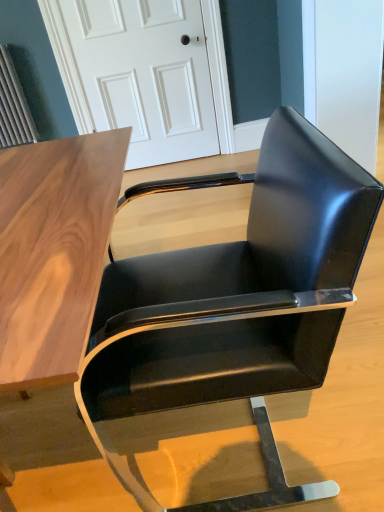
Question: Are glossy black chair at center and white glossy door at upper center located far from each other?

Choices:
 (A) no
 (B) yes

Answer: (B)

Question: Can you confirm if glossy black chair at center is shorter than white glossy door at upper center?

Choices:
 (A) no
 (B) yes

Answer: (B)

Question: Is glossy black chair at center at the left side of white glossy door at upper center?

Choices:
 (A) yes
 (B) no

Answer: (B)

Question: Is glossy black chair at center in front of white glossy door at upper center?

Choices:
 (A) no
 (B) yes

Answer: (B)

Question: Is glossy black chair at center turned away from white glossy door at upper center?

Choices:
 (A) no
 (B) yes

Answer: (A)

Question: Does glossy black chair at center lie behind white glossy door at upper center?

Choices:
 (A) no
 (B) yes

Answer: (A)

Question: Is white glossy door at upper center far from glossy black chair at center?

Choices:
 (A) no
 (B) yes

Answer: (B)

Question: From a real-world perspective, is white glossy door at upper center located beneath glossy black chair at center?

Choices:
 (A) no
 (B) yes

Answer: (A)

Question: Can you confirm if white glossy door at upper center is smaller than glossy black chair at center?

Choices:
 (A) yes
 (B) no

Answer: (A)

Question: From a real-world perspective, is white glossy door at upper center positioned over glossy black chair at center based on gravity?

Choices:
 (A) no
 (B) yes

Answer: (B)

Question: From the image's perspective, would you say white glossy door at upper center is shown under glossy black chair at center?

Choices:
 (A) yes
 (B) no

Answer: (B)

Question: Can glossy black chair at center be found inside white glossy door at upper center?

Choices:
 (A) no
 (B) yes

Answer: (A)

Question: Visually, is glossy black chair at center positioned to the left or to the right of white glossy door at upper center?

Choices:
 (A) right
 (B) left

Answer: (A)